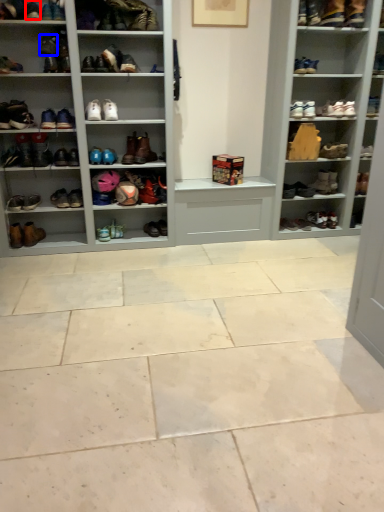
Question: Which point is further to the camera, shoe (highlighted by a red box) or shoe (highlighted by a blue box)?

Choices:
 (A) shoe
 (B) shoe

Answer: (B)